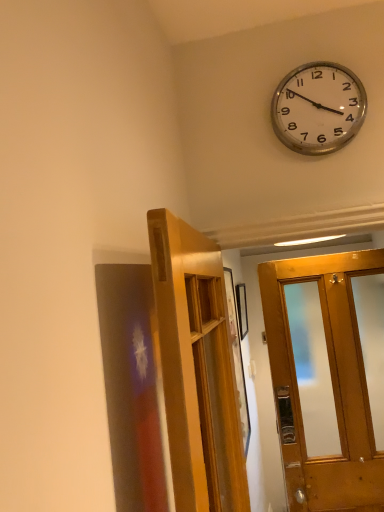
Question: Considering the relative sizes of wooden door at center and silver metallic clock at upper right in the image provided, is wooden door at center shorter than silver metallic clock at upper right?

Choices:
 (A) no
 (B) yes

Answer: (A)

Question: Is wooden door at center taller than silver metallic clock at upper right?

Choices:
 (A) yes
 (B) no

Answer: (A)

Question: Is wooden door at center facing away from silver metallic clock at upper right?

Choices:
 (A) yes
 (B) no

Answer: (B)

Question: From the image's perspective, is wooden door at center over silver metallic clock at upper right?

Choices:
 (A) yes
 (B) no

Answer: (B)

Question: From a real-world perspective, is wooden door at center physically above silver metallic clock at upper right?

Choices:
 (A) no
 (B) yes

Answer: (A)

Question: Are wooden door at center and silver metallic clock at upper right far apart?

Choices:
 (A) yes
 (B) no

Answer: (B)

Question: From a real-world perspective, is silver metallic clock at upper right positioned under wooden door at center based on gravity?

Choices:
 (A) no
 (B) yes

Answer: (A)

Question: Does silver metallic clock at upper right have a lesser width compared to wooden door at center?

Choices:
 (A) yes
 (B) no

Answer: (A)

Question: Is silver metallic clock at upper right positioned behind wooden door at center?

Choices:
 (A) yes
 (B) no

Answer: (A)

Question: Is there a large distance between silver metallic clock at upper right and wooden door at center?

Choices:
 (A) yes
 (B) no

Answer: (B)

Question: Is wooden door at center located within silver metallic clock at upper right?

Choices:
 (A) no
 (B) yes

Answer: (A)

Question: Can you confirm if silver metallic clock at upper right is positioned to the left of wooden door at center?

Choices:
 (A) no
 (B) yes

Answer: (A)

Question: In the image, is wooden door at center positioned in front of or behind silver metallic clock at upper right?

Choices:
 (A) behind
 (B) front

Answer: (B)